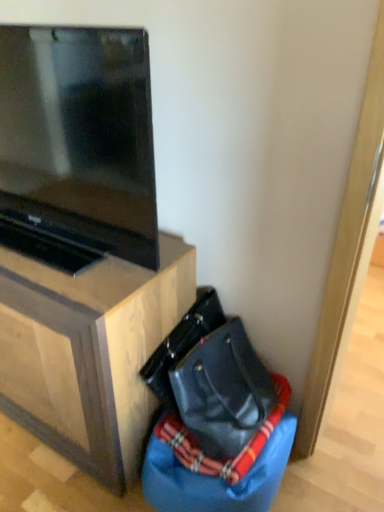
Question: From the image's perspective, is black leather messenger bag at lower right positioned above or below matte black tv at upper left?

Choices:
 (A) above
 (B) below

Answer: (B)

Question: Considering the positions of black leather messenger bag at lower right and matte black tv at upper left in the image, is black leather messenger bag at lower right wider or thinner than matte black tv at upper left?

Choices:
 (A) wide
 (B) thin

Answer: (B)

Question: Estimate the real-world distances between objects in this image. Which object is farther from the black leather messenger bag at lower right?

Choices:
 (A) blue fabric bean bag chair at lower right
 (B) wooden tv stand at lower left
 (C) matte black tv at upper left

Answer: (C)

Question: Estimate the real-world distances between objects in this image. Which object is farther from the wooden tv stand at lower left?

Choices:
 (A) matte black tv at upper left
 (B) blue fabric bean bag chair at lower right
 (C) black leather messenger bag at lower right

Answer: (A)